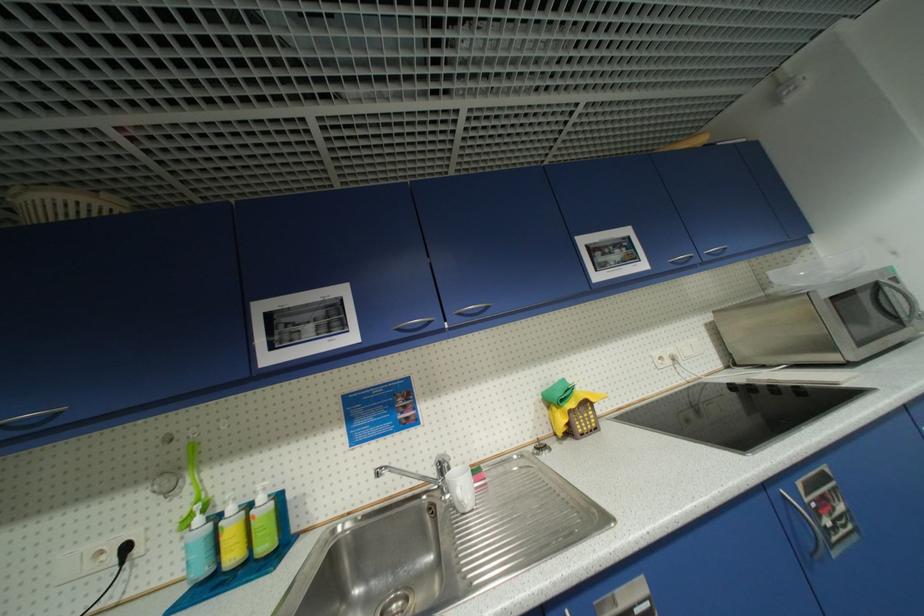
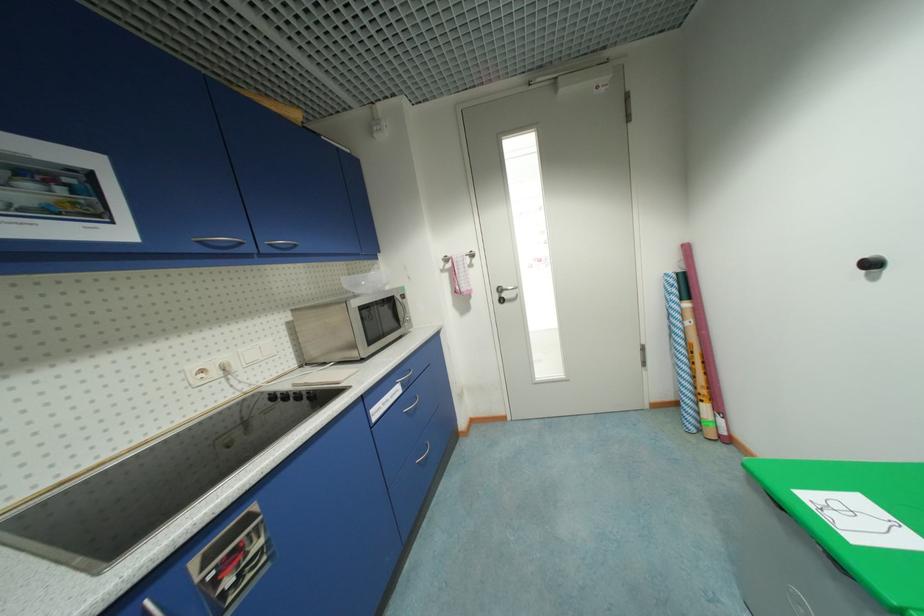
Question: The camera is either moving clockwise (left) or counter-clockwise (right) around the object. The first image is from the beginning of the video and the second image is from the end. Is the camera moving left or right when shooting the video?

Choices:
 (A) Left
 (B) Right

Answer: (A)